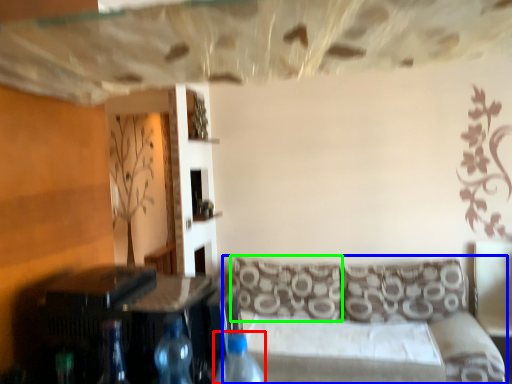
Question: Which is nearer to the bottle (highlighted by a red box)? studio couch (highlighted by a blue box) or pillow (highlighted by a green box).

Choices:
 (A) studio couch
 (B) pillow

Answer: (A)